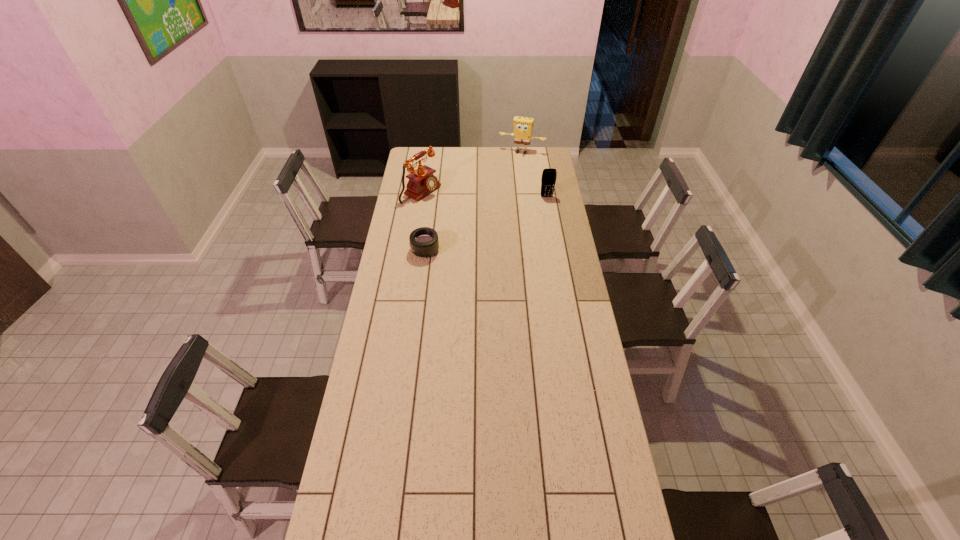
Locate an element on the screen. The width and height of the screenshot is (960, 540). free space at the near edge of the desktop is located at coordinates (572, 521).

You are a GUI agent. You are given a task and a screenshot of the screen. Output one action in this format:
    pyautogui.click(x=<x>, y=<y>)
    Task: Click on the vacant space at the left edge of the desktop
    Image resolution: width=960 pixels, height=540 pixels.
    Given the screenshot: What is the action you would take?
    pyautogui.click(x=424, y=217)

Where is `free region at the right edge of the desktop`? This screenshot has height=540, width=960. free region at the right edge of the desktop is located at coordinates (564, 206).

In the image, there is a desktop. Identify the location of free space at the near left corner. (381, 511).

Where is `blank region between the telephone and the sponge`? The width and height of the screenshot is (960, 540). blank region between the telephone and the sponge is located at coordinates (471, 172).

At what (x,y) coordinates should I click in order to perform the action: click on unoccupied area between the cellular telephone and the farthest object. Please return your answer as a coordinate pair (x, y). Looking at the image, I should click on (534, 174).

The image size is (960, 540). In order to click on free space between the telephone and the cellular telephone in this screenshot , I will do pyautogui.click(x=484, y=194).

Find the location of `free space between the third tallest object and the telephoto lens`. free space between the third tallest object and the telephoto lens is located at coordinates (486, 224).

Locate an element on the screen. This screenshot has width=960, height=540. empty location between the second shortest object and the sponge is located at coordinates (534, 174).

Where is `free space between the second shortest object and the telephone`? This screenshot has height=540, width=960. free space between the second shortest object and the telephone is located at coordinates click(484, 194).